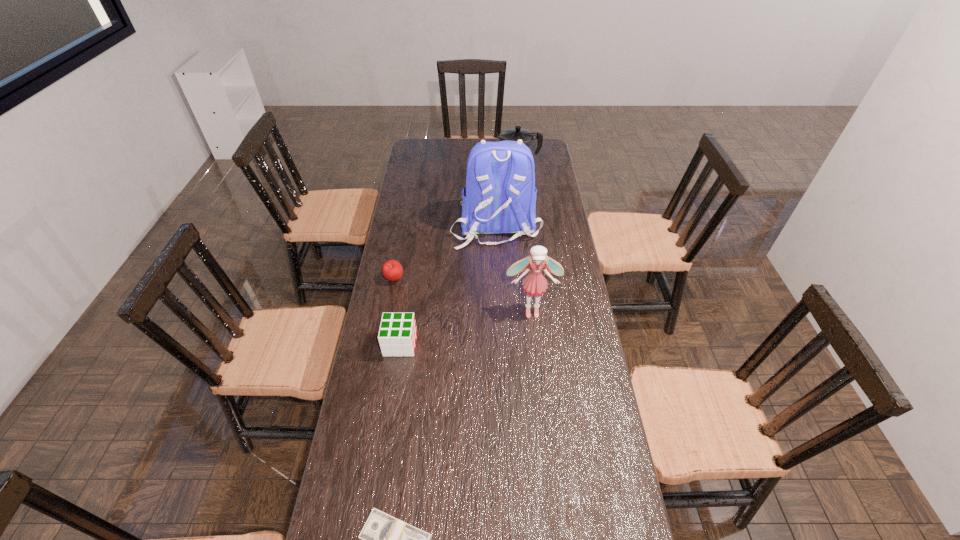
Where is `vacant space situated on the back of the tallest object`? The height and width of the screenshot is (540, 960). vacant space situated on the back of the tallest object is located at coordinates (498, 304).

Locate an element on the screen. The image size is (960, 540). free space located on the front-facing side of the doll is located at coordinates (540, 396).

You are a GUI agent. You are given a task and a screenshot of the screen. Output one action in this format:
    pyautogui.click(x=<x>, y=<y>)
    Task: Click on the free location located at the spout of the fourth shortest object
    This screenshot has height=540, width=960.
    Given the screenshot: What is the action you would take?
    pyautogui.click(x=480, y=171)

The width and height of the screenshot is (960, 540). In order to click on vacant space located at the spout of the fourth shortest object in this screenshot , I will do `click(427, 171)`.

The height and width of the screenshot is (540, 960). I want to click on vacant position located at the spout of the fourth shortest object, so click(x=415, y=171).

Identify the location of free location located on the red face of the third shortest object. (470, 344).

The width and height of the screenshot is (960, 540). In order to click on free location located 0.300m on the right of the apple in this screenshot , I will do `click(484, 279)`.

The image size is (960, 540). What are the coordinates of `cube present at the left edge` in the screenshot? It's located at (397, 336).

Where is `apple present at the left edge`? apple present at the left edge is located at coordinates (392, 270).

Where is `backpack located at the right edge`? backpack located at the right edge is located at coordinates (500, 196).